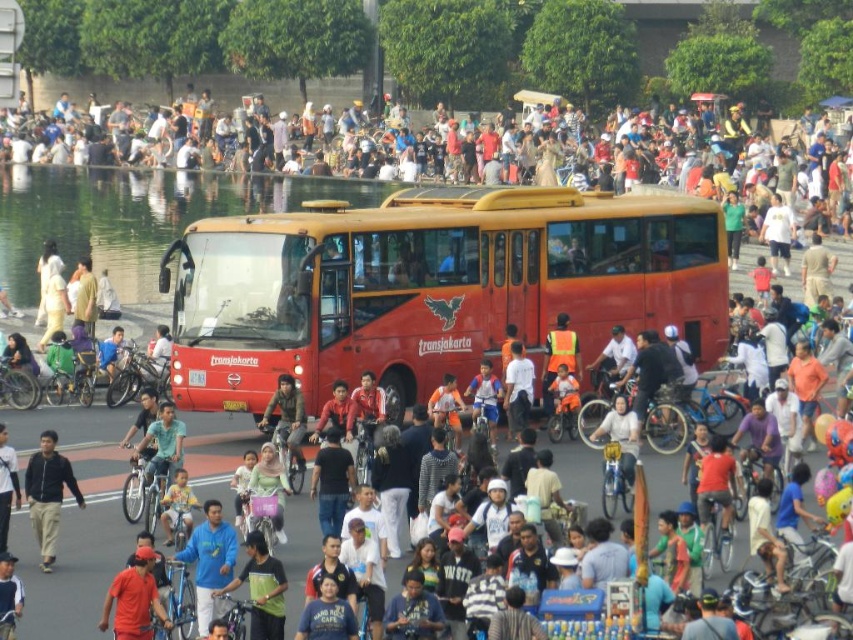
You are a photographer standing on the sidewalk, and you want to capture a photo of the matte black jacket at center and the jeans at center. Which one should you focus on first to ensure both are in sharp focus?

You should focus on the matte black jacket at center first because it is closer to the viewer than the jeans at center, so adjusting focus from near to far will help both be in sharp focus.

You are a pedestrian standing at the edge of the street in this scene. You see a person wearing a matte black jacket at center and jeans at center. If you want to reach both individuals, which one would you need to walk further to reach first?

The distance between the matte black jacket at center and jeans at center is 6.75 meters, so you would need to walk further to reach the one that is farther away. However, without knowing your starting position relative to both, it is impossible to determine which requires a longer walk.

You are a pedestrian standing at the orange fabric shirt at lower left position. You want to cross the street to reach the other side. The street is 60 feet wide. Can you safely cross the street before the matte red bus at center passes by?

The matte red bus at center is 58.02 feet away from the orange fabric shirt at lower left. Since the street is 60 feet wide, the distance between you and the bus is less than the street width. Therefore, you should not attempt to cross as the bus may reach you before you can safely cross the entire street.